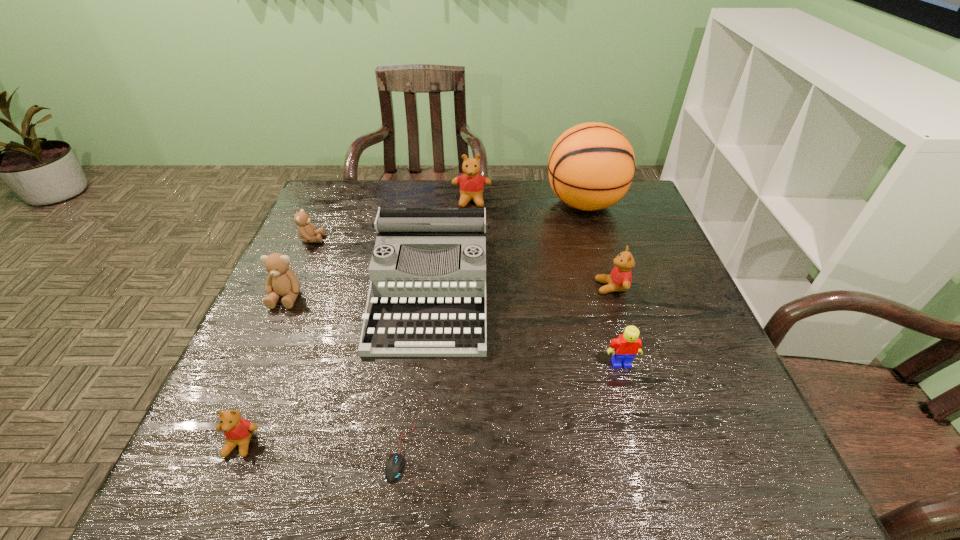
You are a GUI agent. You are given a task and a screenshot of the screen. Output one action in this format:
    pyautogui.click(x=<x>, y=<y>)
    Task: Click on the red teddy bear that is the closest to the farther brown teddy bear
    The width and height of the screenshot is (960, 540).
    Given the screenshot: What is the action you would take?
    pyautogui.click(x=471, y=184)

In order to click on red teddy bear that can be found as the second closest to the biggest red teddy bear in this screenshot , I will do `click(238, 431)`.

This screenshot has width=960, height=540. What are the coordinates of `free space that satisfies the following two spatial constraints: 1. on the face of the mouse; 2. on the right side of the fourth nearest teddy bear` in the screenshot? It's located at (217, 451).

The height and width of the screenshot is (540, 960). I want to click on free spot that satisfies the following two spatial constraints: 1. on the face of the farther brown teddy bear; 2. on the back side of the shortest object, so click(x=217, y=451).